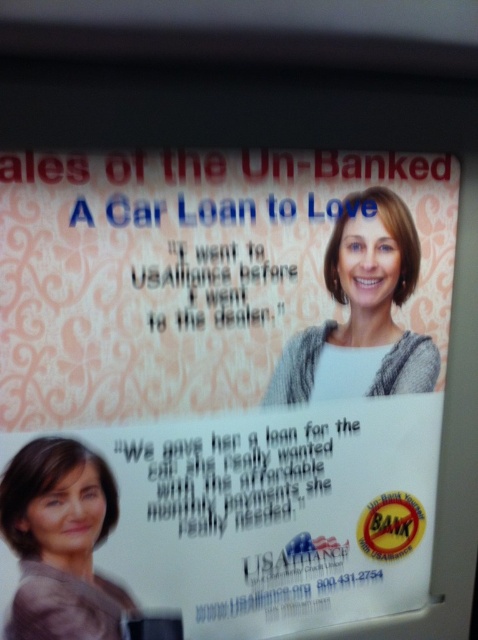
You are a fashion designer reviewing an advertisement for a new clothing line. The ad features a matte gray sweater at lower left and a gray knitted sweater at center. Which sweater takes up more space in the advertisement?

The gray knitted sweater at center occupies more space than the matte gray sweater at lower left.

Looking at this image, you are standing in front of the advertisement and want to touch the point at coordinates point (86, 525). If your hand can reach up to 25 inches, will you be able to reach it?

The point (86, 525) is 25.69 inches away from you, so your hand cannot reach it since it exceeds the 25 inches limit.

You are designing a layout for a promotional poster and need to place the white paper poster at center and the matte gray sweater at lower left. Given their sizes, which object should be placed first to ensure proper alignment?

The white paper poster at center should be placed first since it is larger in size than the matte gray sweater at lower left, ensuring proper alignment by starting with the bigger element.